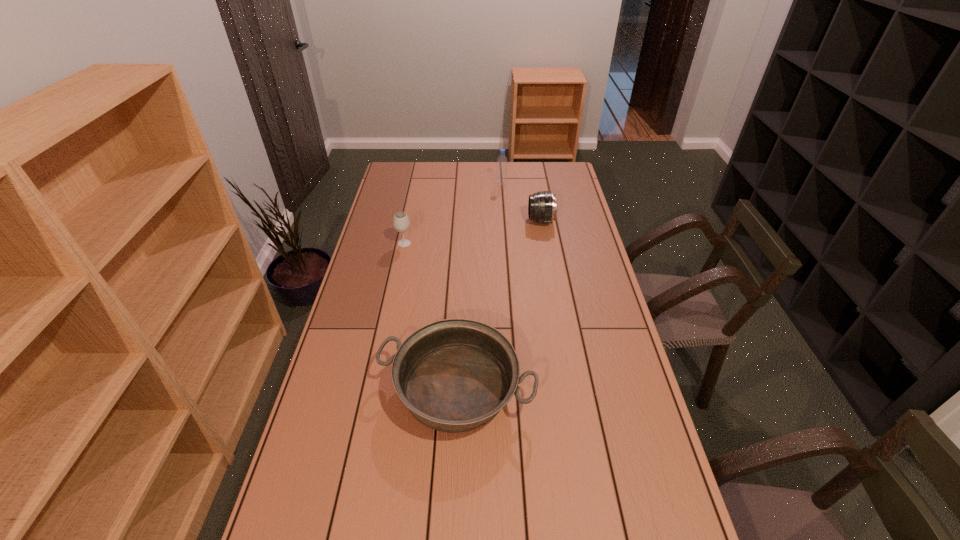
The image size is (960, 540). I want to click on bottle, so [x=502, y=162].

Find the location of a particular element. the tallest object is located at coordinates (502, 162).

At what (x,y) coordinates should I click in order to perform the action: click on the second nearest object. Please return your answer as a coordinate pair (x, y). The image size is (960, 540). Looking at the image, I should click on (401, 223).

I want to click on telephoto lens, so click(542, 208).

This screenshot has height=540, width=960. What are the coordinates of `the rightmost object` in the screenshot? It's located at (542, 208).

Locate an element on the screen. Image resolution: width=960 pixels, height=540 pixels. pan is located at coordinates (454, 375).

The image size is (960, 540). What are the coordinates of `the nearest object` in the screenshot? It's located at (454, 375).

At what (x,y) coordinates should I click in order to perform the action: click on free spot located 0.340m on the left of the tallest object. Please return your answer as a coordinate pair (x, y). The image size is (960, 540). Looking at the image, I should click on (425, 185).

Identify the location of vacant space located 0.340m on the front of the wineglass. The image size is (960, 540). [391, 310].

The height and width of the screenshot is (540, 960). In order to click on free spot located at the front element of the rightmost object in this screenshot , I will do click(438, 221).